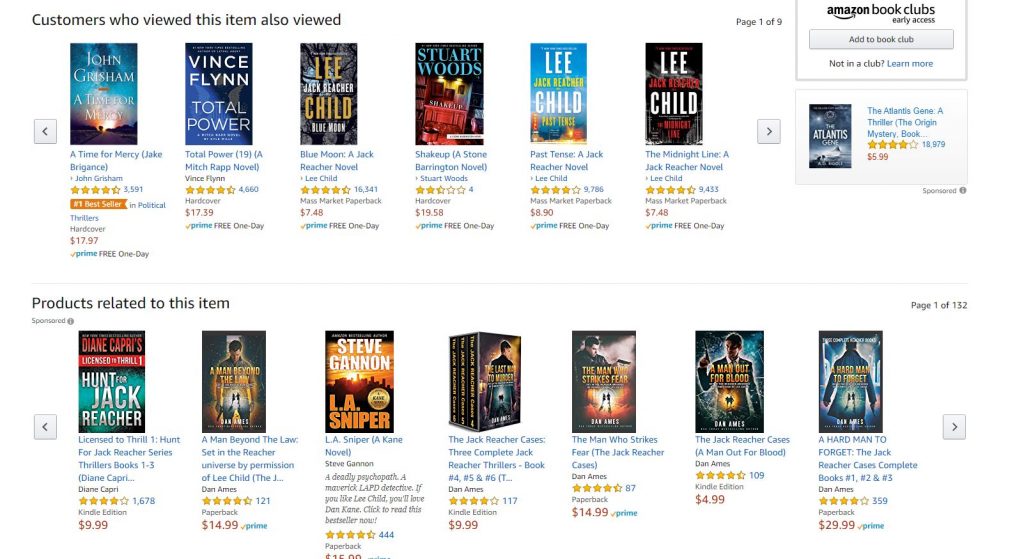
This screenshot has width=1024, height=559. In order to click on books with blur on the cover in this screenshot , I will do `click(103, 99)`, `click(201, 100)`, `click(325, 68)`, `click(455, 72)`, `click(574, 100)`, `click(117, 391)`, `click(739, 378)`, `click(837, 389)`, `click(507, 391)`.